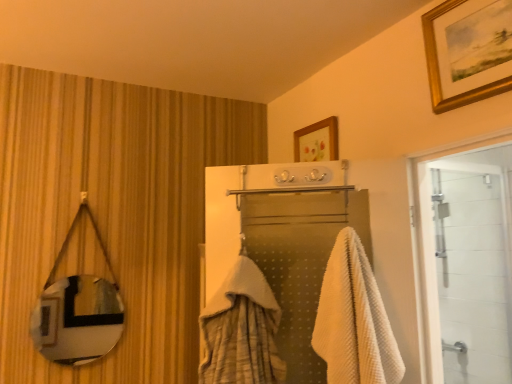
Question: Is gold-framed picture at upper right oriented away from white waffle towel at center?

Choices:
 (A) no
 (B) yes

Answer: (A)

Question: Does gold-framed picture at upper right have a greater height compared to white waffle towel at center?

Choices:
 (A) no
 (B) yes

Answer: (A)

Question: Could you tell me if gold-framed picture at upper right is facing white waffle towel at center?

Choices:
 (A) yes
 (B) no

Answer: (B)

Question: Can we say gold-framed picture at upper right lies outside white waffle towel at center?

Choices:
 (A) yes
 (B) no

Answer: (A)

Question: Can you confirm if gold-framed picture at upper right is bigger than white waffle towel at center?

Choices:
 (A) no
 (B) yes

Answer: (A)

Question: From the image's perspective, relative to gold-framed picture at upper right, is white glass door at right above or below?

Choices:
 (A) above
 (B) below

Answer: (B)

Question: Is white glass door at right spatially inside gold-framed picture at upper right, or outside of it?

Choices:
 (A) inside
 (B) outside

Answer: (B)

Question: Looking at the image, does white glass door at right seem bigger or smaller compared to gold-framed picture at upper right?

Choices:
 (A) big
 (B) small

Answer: (A)

Question: Considering the positions of white glass door at right and gold-framed picture at upper right in the image, is white glass door at right wider or thinner than gold-framed picture at upper right?

Choices:
 (A) wide
 (B) thin

Answer: (A)

Question: In the image, is white waffle towel at center positioned in front of or behind gold-framed picture at upper right?

Choices:
 (A) behind
 (B) front

Answer: (A)

Question: In the image, is white waffle towel at center on the left side or the right side of gold-framed picture at upper right?

Choices:
 (A) right
 (B) left

Answer: (B)

Question: In terms of size, does white waffle towel at center appear bigger or smaller than gold-framed picture at upper right?

Choices:
 (A) small
 (B) big

Answer: (B)

Question: In terms of height, does white waffle towel at center look taller or shorter compared to gold-framed picture at upper right?

Choices:
 (A) short
 (B) tall

Answer: (B)

Question: From the image's perspective, relative to white waffle towel at center, is metallic reflective mirror at left above or below?

Choices:
 (A) above
 (B) below

Answer: (B)

Question: In the image, is metallic reflective mirror at left positioned in front of or behind white waffle towel at center?

Choices:
 (A) behind
 (B) front

Answer: (A)